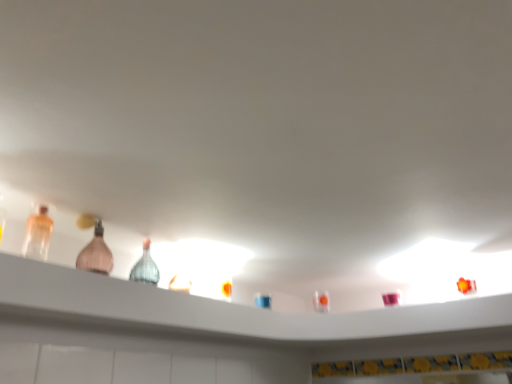
Question: Is translucent plastic bottle at left, which is counted as the second bottle, starting from the back, at the right side of pink glass bottle at left, which ranks as the first bottle in right-to-left order?

Choices:
 (A) no
 (B) yes

Answer: (A)

Question: Considering the relative sizes of translucent plastic bottle at left, the 2th bottle in the right-to-left sequence, and pink glass bottle at left, which is the second bottle from front to back, in the image provided, is translucent plastic bottle at left, the 2th bottle in the right-to-left sequence, wider than pink glass bottle at left, which is the second bottle from front to back,?

Choices:
 (A) yes
 (B) no

Answer: (B)

Question: Does translucent plastic bottle at left, the 2th bottle in the right-to-left sequence, appear on the left side of pink glass bottle at left, which ranks as the first bottle in right-to-left order?

Choices:
 (A) yes
 (B) no

Answer: (A)

Question: From the image's perspective, is translucent plastic bottle at left, the 1th bottle when ordered from left to right, under pink glass bottle at left, acting as the first bottle starting from the back?

Choices:
 (A) no
 (B) yes

Answer: (A)

Question: Could you tell me if translucent plastic bottle at left, the 2th bottle in the right-to-left sequence, is facing pink glass bottle at left, which is the second bottle from front to back?

Choices:
 (A) no
 (B) yes

Answer: (A)

Question: Looking at the image, does translucent plastic bottle at left, the first bottle in the front-to-back sequence, seem bigger or smaller compared to pink glass bottle at left, which is the second bottle from front to back?

Choices:
 (A) small
 (B) big

Answer: (A)

Question: From a real-world perspective, relative to pink glass bottle at left, which is the second bottle from front to back, is translucent plastic bottle at left, the 2th bottle in the right-to-left sequence, vertically above or below?

Choices:
 (A) above
 (B) below

Answer: (B)

Question: From the image's perspective, is translucent plastic bottle at left, the 1th bottle when ordered from left to right, located above or below pink glass bottle at left, acting as the first bottle starting from the back?

Choices:
 (A) above
 (B) below

Answer: (A)

Question: In terms of height, does translucent plastic bottle at left, the 2th bottle in the right-to-left sequence, look taller or shorter compared to pink glass bottle at left, the 2th bottle when ordered from left to right?

Choices:
 (A) tall
 (B) short

Answer: (B)

Question: From the image's perspective, relative to translucent glass bottles at upper center, is pink glass bottle at left, the 2th bottle when ordered from left to right, above or below?

Choices:
 (A) below
 (B) above

Answer: (B)

Question: From a real-world perspective, is pink glass bottle at left, which ranks as the first bottle in right-to-left order, positioned above or below translucent glass bottles at upper center?

Choices:
 (A) above
 (B) below

Answer: (A)

Question: In terms of width, does pink glass bottle at left, acting as the first bottle starting from the back, look wider or thinner when compared to translucent glass bottles at upper center?

Choices:
 (A) wide
 (B) thin

Answer: (B)

Question: Is pink glass bottle at left, which is the second bottle from front to back, inside or outside of translucent glass bottles at upper center?

Choices:
 (A) outside
 (B) inside

Answer: (A)

Question: Is translucent glass bottles at upper center spatially inside translucent plastic bottle at left, the 2th bottle in the right-to-left sequence, or outside of it?

Choices:
 (A) inside
 (B) outside

Answer: (B)

Question: In terms of size, does translucent glass bottles at upper center appear bigger or smaller than translucent plastic bottle at left, the 2th bottle in the right-to-left sequence?

Choices:
 (A) big
 (B) small

Answer: (A)